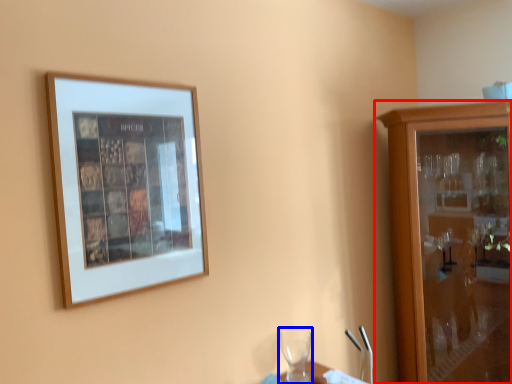
Question: Which object appears farthest to the camera in this image, cabinetry (highlighted by a red box) or wine glass (highlighted by a blue box)?

Choices:
 (A) cabinetry
 (B) wine glass

Answer: (A)